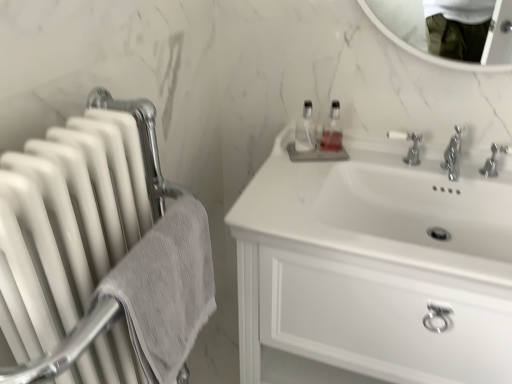
At what (x,y) coordinates should I click in order to perform the action: click on vacant area that lies to the right of silver metallic tap at upper center, which ranks as the 1th tap in left-to-right order. Please return your answer as a coordinate pair (x, y). The width and height of the screenshot is (512, 384). Looking at the image, I should click on (442, 166).